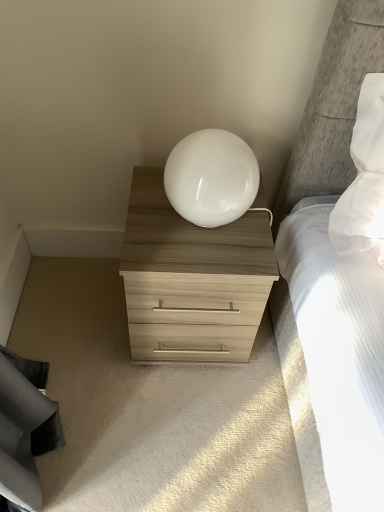
The height and width of the screenshot is (512, 384). What do you see at coordinates (212, 178) in the screenshot?
I see `white glossy sphere at center` at bounding box center [212, 178].

Where is `white glossy sphere at center`? This screenshot has width=384, height=512. white glossy sphere at center is located at coordinates (212, 178).

The image size is (384, 512). What are the coordinates of `light wood/texture chest of drawers at center` in the screenshot? It's located at (192, 279).

The width and height of the screenshot is (384, 512). Describe the element at coordinates (192, 279) in the screenshot. I see `light wood/texture chest of drawers at center` at that location.

Locate an element on the screen. The image size is (384, 512). white glossy sphere at center is located at coordinates (212, 178).

Between white glossy sphere at center and light wood/texture chest of drawers at center, which one appears on the right side from the viewer's perspective?

From the viewer's perspective, white glossy sphere at center appears more on the right side.

Who is more distant, white glossy sphere at center or light wood/texture chest of drawers at center?

light wood/texture chest of drawers at center is further from the camera.

Is point (218, 210) positioned in front of point (154, 257)?

Yes, point (218, 210) is closer to viewer.

From the image's perspective, which one is positioned lower, white glossy sphere at center or light wood/texture chest of drawers at center?

light wood/texture chest of drawers at center is shown below in the image.

From a real-world perspective, between white glossy sphere at center and light wood/texture chest of drawers at center, who is vertically higher?

white glossy sphere at center is physically above.

Can you confirm if white glossy sphere at center is thinner than light wood/texture chest of drawers at center?

Yes.

Between white glossy sphere at center and light wood/texture chest of drawers at center, which one has less height?

Standing shorter between the two is white glossy sphere at center.

Between white glossy sphere at center and light wood/texture chest of drawers at center, which one has larger size?

light wood/texture chest of drawers at center.

From the picture: Would you say white glossy sphere at center is outside light wood/texture chest of drawers at center?

Answer: white glossy sphere at center is positioned outside light wood/texture chest of drawers at center.

Looking at this image, are white glossy sphere at center and light wood/texture chest of drawers at center making contact?

No, white glossy sphere at center is not beside light wood/texture chest of drawers at center.

Is white glossy sphere at center oriented towards light wood/texture chest of drawers at center?

No, white glossy sphere at center is not oriented towards light wood/texture chest of drawers at center.

Measure the distance between white glossy sphere at center and light wood/texture chest of drawers at center.

The distance of white glossy sphere at center from light wood/texture chest of drawers at center is 7.85 inches.

The image size is (384, 512). What are the coordinates of `the chest of drawers behind the white glossy sphere at center` in the screenshot? It's located at (192, 279).

In the image, is light wood/texture chest of drawers at center on the left side or the right side of white glossy sphere at center?

Clearly, light wood/texture chest of drawers at center is on the left of white glossy sphere at center in the image.

Does light wood/texture chest of drawers at center lie behind white glossy sphere at center?

Yes, light wood/texture chest of drawers at center is behind white glossy sphere at center.

Is point (216, 298) more distant than point (237, 180)?

Yes, point (216, 298) is farther from viewer.

From the image's perspective, which is above, light wood/texture chest of drawers at center or white glossy sphere at center?

white glossy sphere at center.

From a real-world perspective, is light wood/texture chest of drawers at center above or below white glossy sphere at center?

In terms of real-world spatial position, light wood/texture chest of drawers at center is below white glossy sphere at center.

Between light wood/texture chest of drawers at center and white glossy sphere at center, which one has larger width?

light wood/texture chest of drawers at center is wider.

Which of these two, light wood/texture chest of drawers at center or white glossy sphere at center, stands shorter?

white glossy sphere at center.

Looking at the image, does light wood/texture chest of drawers at center seem bigger or smaller compared to white glossy sphere at center?

Clearly, light wood/texture chest of drawers at center is larger in size than white glossy sphere at center.

Would you say light wood/texture chest of drawers at center contains white glossy sphere at center?

No, light wood/texture chest of drawers at center does not contain white glossy sphere at center.

Is there a large distance between light wood/texture chest of drawers at center and white glossy sphere at center?

No, light wood/texture chest of drawers at center is in close proximity to white glossy sphere at center.

Is light wood/texture chest of drawers at center turned away from white glossy sphere at center?

light wood/texture chest of drawers at center does not have its back to white glossy sphere at center.

Locate an element on the screen. table lamp above the light wood/texture chest of drawers at center (from a real-world perspective) is located at coordinates (212, 178).

The width and height of the screenshot is (384, 512). Find the location of `the chest of drawers below the white glossy sphere at center (from the image's perspective)`. the chest of drawers below the white glossy sphere at center (from the image's perspective) is located at coordinates (192, 279).

Locate an element on the screen. table lamp above the light wood/texture chest of drawers at center (from the image's perspective) is located at coordinates (212, 178).